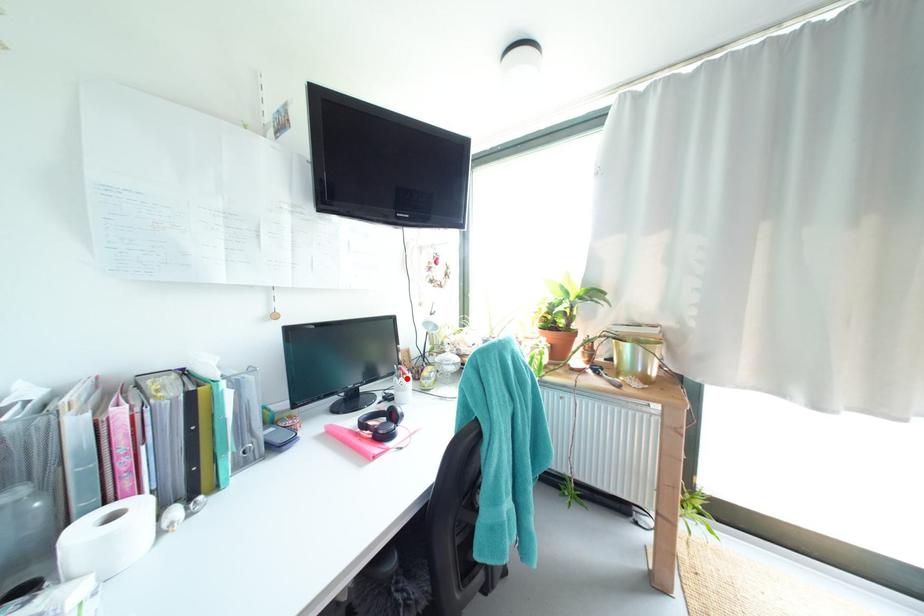
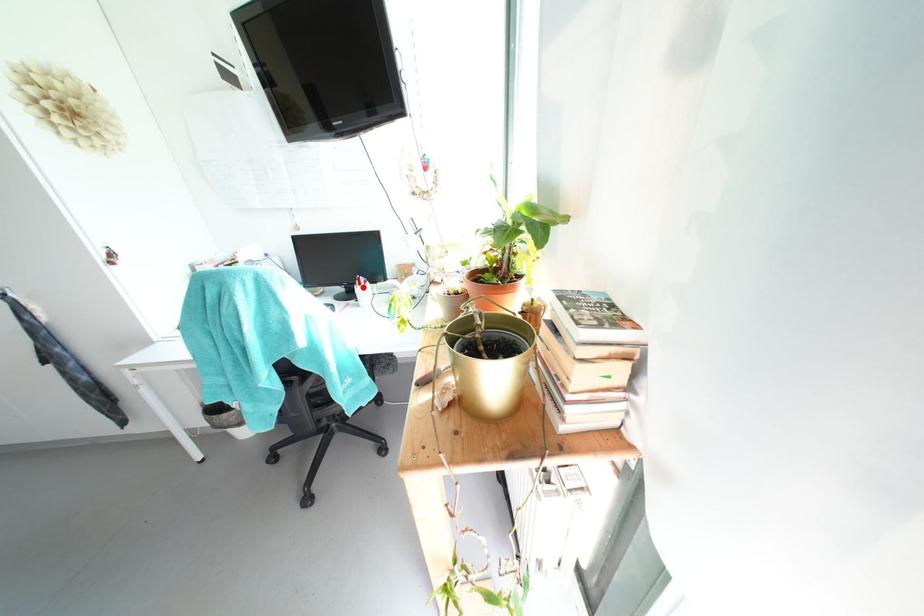
I am providing you with two images of the same scene from different viewpoints. A red point is marked on the first image and another point is marked on the second image. Are the points marked in image1 and image2 representing the same 3D position?

Yes